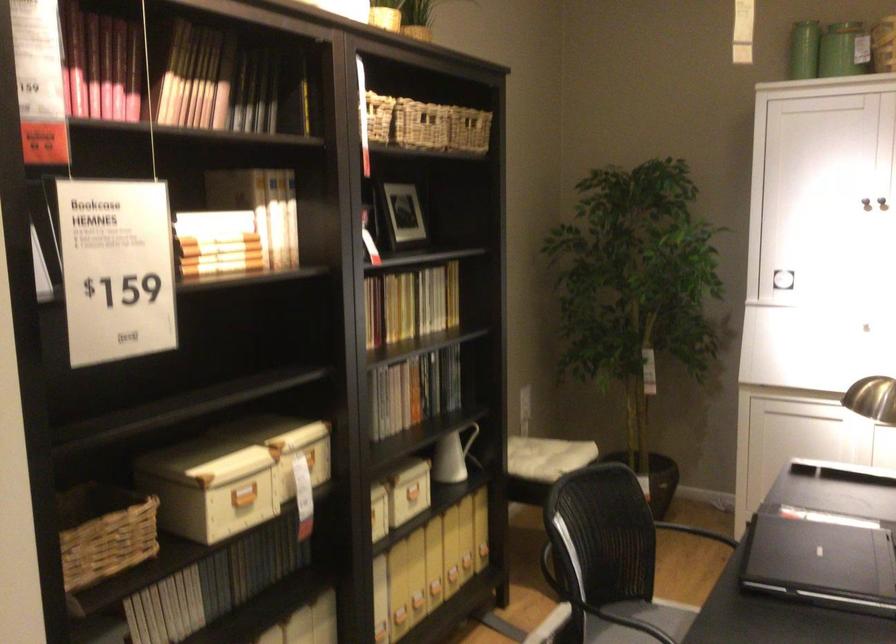
At what (x,y) coordinates should I click in order to perform the action: click on desk lamp head. Please return your answer as a coordinate pair (x, y). This screenshot has height=644, width=896. Looking at the image, I should click on click(872, 399).